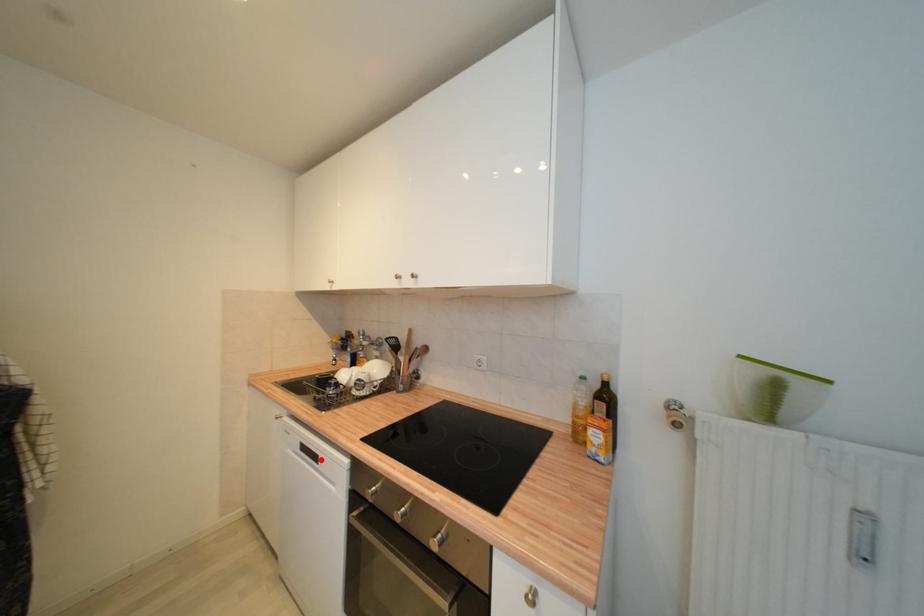
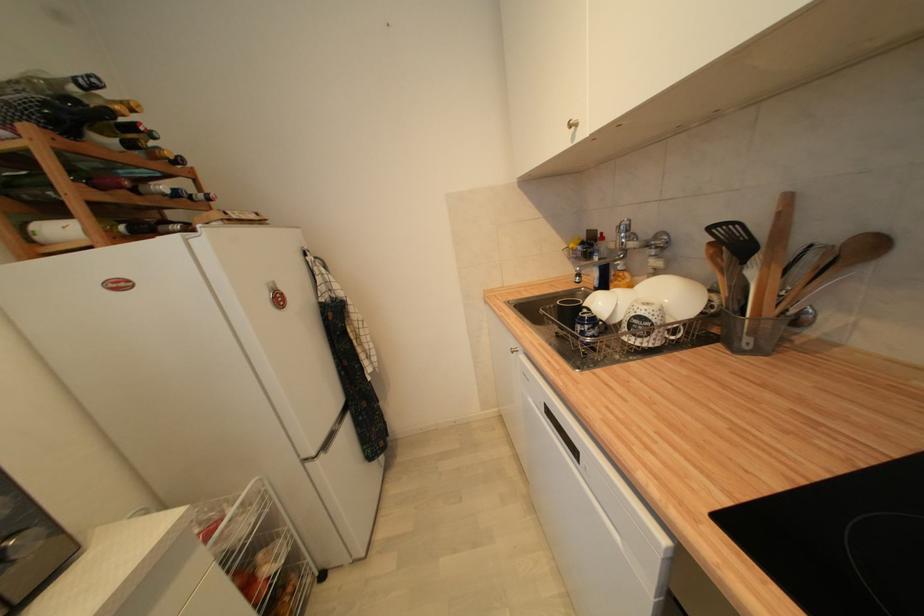
Question: I am providing you with two images of the same scene from different viewpoints. Given a red point in image1, look at the same physical point in image2. Is it:

Choices:
 (A) Closer to the viewpoint
 (B) Farther from the viewpoint

Answer: (A)